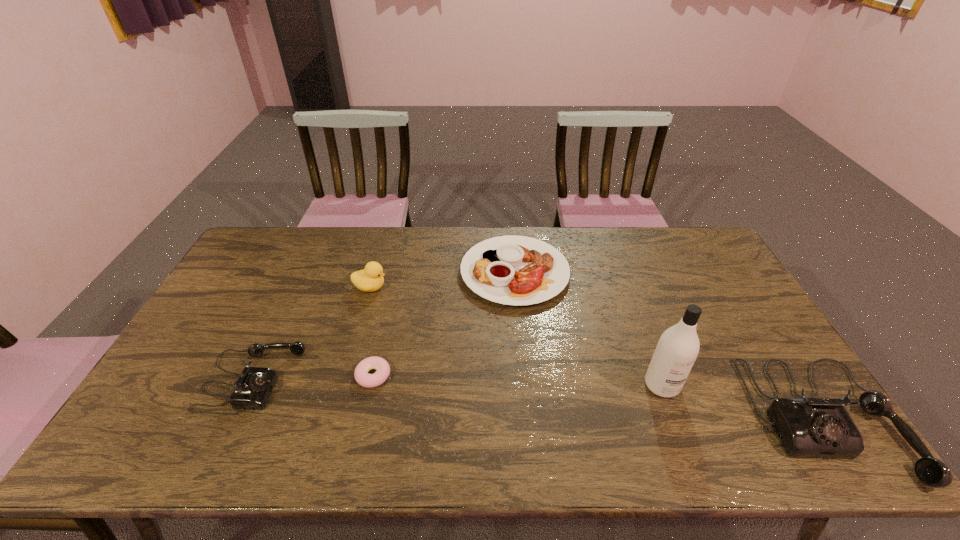
Where is `the leftmost object`? This screenshot has width=960, height=540. the leftmost object is located at coordinates (252, 390).

In order to click on the shorter telephone in this screenshot , I will do `click(252, 390)`.

Locate an element on the screen. This screenshot has height=540, width=960. the fifth shortest object is located at coordinates (808, 427).

At what (x,y) coordinates should I click in order to perform the action: click on the taller telephone. Please return your answer as a coordinate pair (x, y). This screenshot has height=540, width=960. Looking at the image, I should click on (808, 427).

The image size is (960, 540). In order to click on the second shortest object in this screenshot , I will do `click(516, 270)`.

The height and width of the screenshot is (540, 960). I want to click on the third object from right to left, so click(x=516, y=270).

Find the location of a particular element. Image resolution: width=960 pixels, height=540 pixels. duck is located at coordinates (370, 279).

Find the location of a particular element. This screenshot has width=960, height=540. the shortest object is located at coordinates (362, 377).

At what (x,y) coordinates should I click in order to perform the action: click on shampoo. Please return your answer as a coordinate pair (x, y). Looking at the image, I should click on (678, 347).

Identify the location of the tallest object. The width and height of the screenshot is (960, 540). (678, 347).